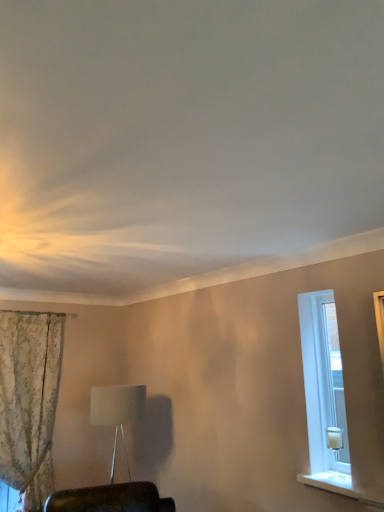
Question: From a real-world perspective, is white smooth window sill at lower right physically located above or below white glass candle at right?

Choices:
 (A) above
 (B) below

Answer: (B)

Question: Considering their positions, is white smooth window sill at lower right located in front of or behind white glass candle at right?

Choices:
 (A) front
 (B) behind

Answer: (A)

Question: Which of these objects is positioned closest to the white fabric lampshade at center?

Choices:
 (A) white smooth window sill at lower right
 (B) white glass candle at right
 (C) floral fabric curtain at left

Answer: (C)

Question: Based on their relative distances, which object is farther from the floral fabric curtain at left?

Choices:
 (A) white fabric lampshade at center
 (B) white glass candle at right
 (C) white smooth window sill at lower right

Answer: (C)